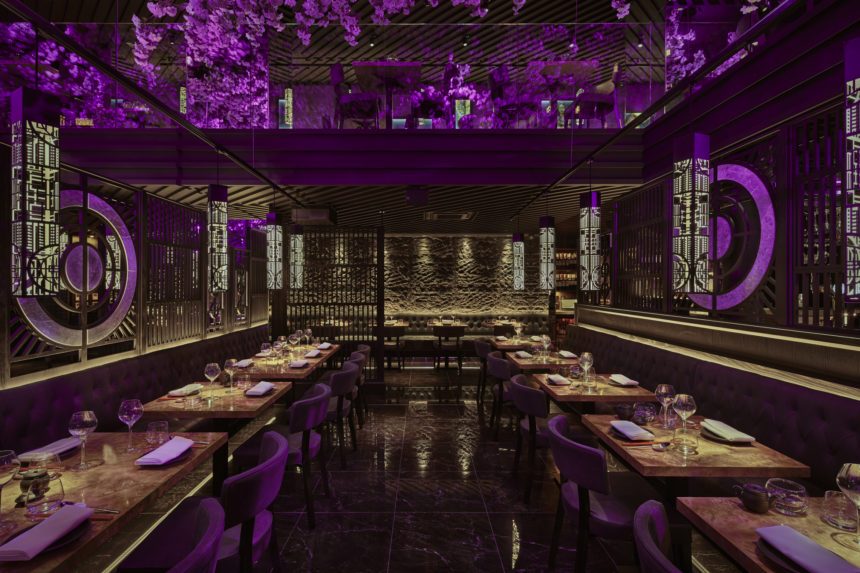
Locate an element on the screen. This screenshot has height=573, width=860. rightmost napkin is located at coordinates pyautogui.click(x=805, y=551).